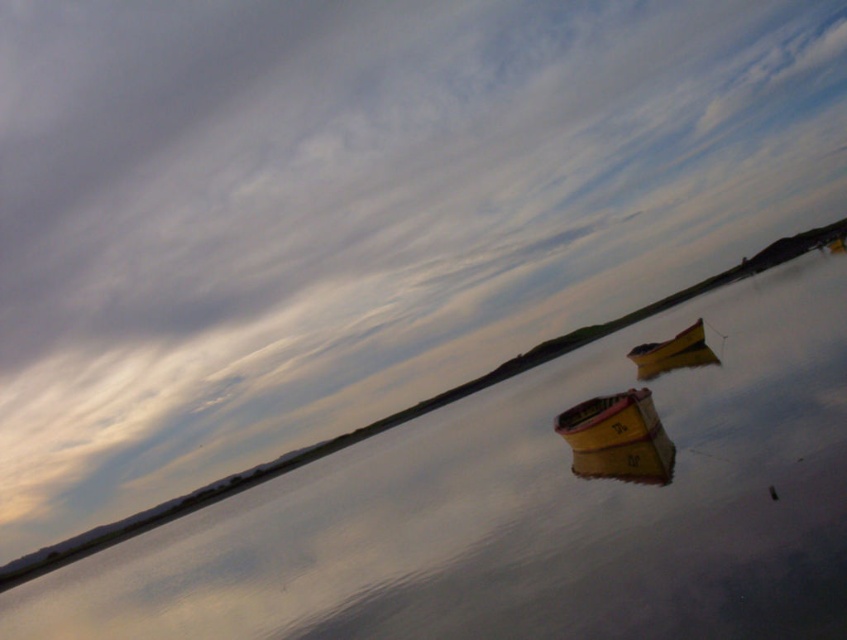
Question: Estimate the real-world distances between objects in this image. Which object is farther from the yellow matte boat at center?

Choices:
 (A) yellow matte boat at center-right
 (B) smooth reflective water at center

Answer: (B)

Question: Is smooth reflective water at center positioned before yellow matte boat at center?

Choices:
 (A) no
 (B) yes

Answer: (B)

Question: Which point is closer to the camera?

Choices:
 (A) smooth reflective water at center
 (B) yellow matte boat at center
 (C) yellow matte boat at center-right

Answer: (A)

Question: Which point is farther from the camera taking this photo?

Choices:
 (A) (757, 305)
 (B) (665, 344)
 (C) (582, 449)

Answer: (A)

Question: Considering the relative positions of smooth reflective water at center and yellow matte boat at center in the image provided, where is smooth reflective water at center located with respect to yellow matte boat at center?

Choices:
 (A) below
 (B) above

Answer: (A)

Question: Is smooth reflective water at center behind yellow matte boat at center?

Choices:
 (A) yes
 (B) no

Answer: (B)